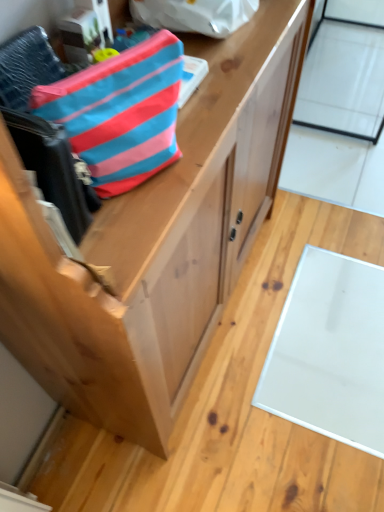
Question: Is blue striped fabric pouch at upper left, the 2th pouch in the top-to-bottom sequence, in front of or behind transparent glass door at upper right in the image?

Choices:
 (A) front
 (B) behind

Answer: (A)

Question: Is blue striped fabric pouch at upper left, the 2th pouch in the top-to-bottom sequence, taller or shorter than transparent glass door at upper right?

Choices:
 (A) short
 (B) tall

Answer: (A)

Question: Which object is positioned closest to the blue striped fabric pouch at upper left, which is the first pouch from bottom to top?

Choices:
 (A) blue striped fabric pouch at upper center, the 2th pouch positioned from the bottom
 (B) natural wood cabinet at center
 (C) transparent glass door at upper right

Answer: (B)

Question: Estimate the real-world distances between objects in this image. Which object is farther from the natural wood cabinet at center?

Choices:
 (A) transparent glass door at upper right
 (B) blue striped fabric pouch at upper center, placed as the first pouch when sorted from back to front
 (C) blue striped fabric pouch at upper left, which is the first pouch from bottom to top

Answer: (A)